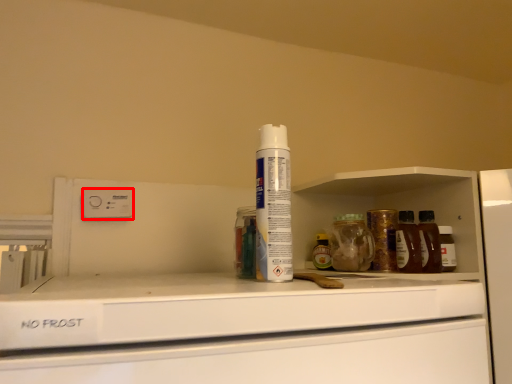
Question: From the image's perspective, considering the relative positions of electric outlet (annotated by the red box) and shaving cream in the image provided, where is electric outlet (annotated by the red box) located with respect to the staircase?

Choices:
 (A) below
 (B) above

Answer: (A)